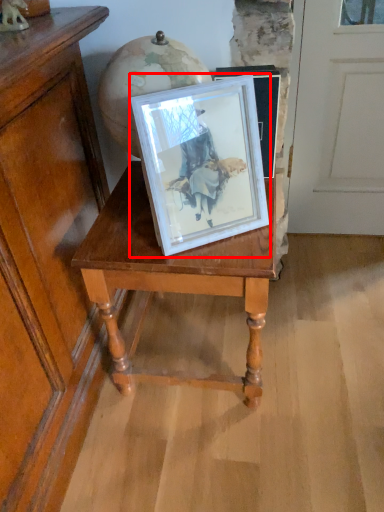
Question: Observing the image, what is the correct spatial positioning of picture frame (annotated by the red box) in reference to table?

Choices:
 (A) right
 (B) left

Answer: (A)